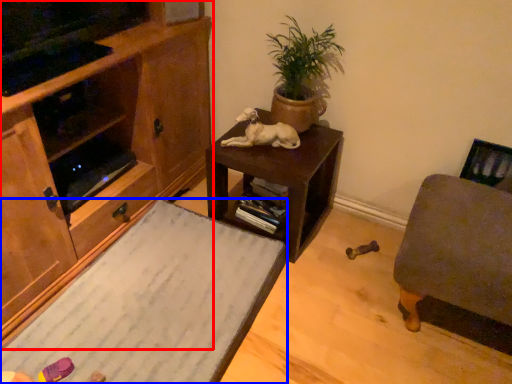
Question: Which object is further to the camera taking this photo, cabinetry (highlighted by a red box) or desk (highlighted by a blue box)?

Choices:
 (A) cabinetry
 (B) desk

Answer: (B)